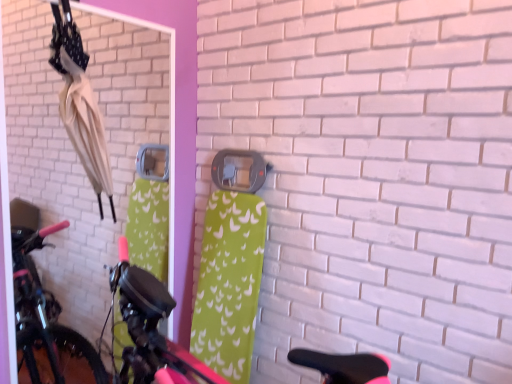
Describe the element at coordinates (80, 103) in the screenshot. Image resolution: width=512 pixels, height=384 pixels. I see `beige fabric umbrella at upper left` at that location.

The width and height of the screenshot is (512, 384). Identify the location of beige fabric umbrella at upper left. (80, 103).

The height and width of the screenshot is (384, 512). I want to click on beige fabric umbrella at upper left, so click(x=80, y=103).